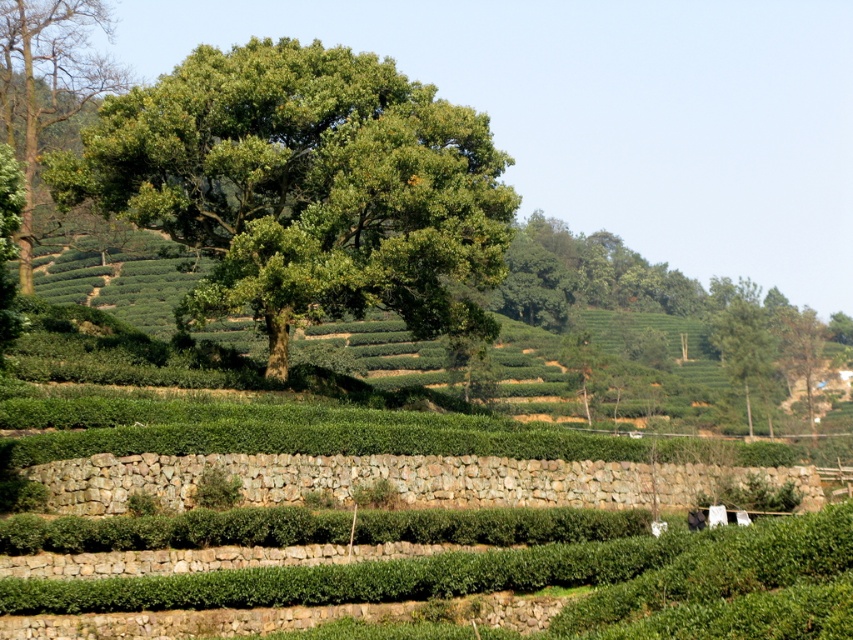
Question: Which object is closer to the camera taking this photo?

Choices:
 (A) green leafy tree at upper right
 (B) green leafy tree at upper left
 (C) green leafy tree at center

Answer: (B)

Question: Which point is farther from the camera taking this photo?

Choices:
 (A) (207, 115)
 (B) (764, 348)

Answer: (B)

Question: Is green leafy tree at upper left further to camera compared to green leafy tree at upper right?

Choices:
 (A) no
 (B) yes

Answer: (A)

Question: Is green leafy tree at center below green leafy tree at upper left?

Choices:
 (A) yes
 (B) no

Answer: (A)

Question: Does green leafy tree at upper left have a smaller size compared to green leafy tree at upper right?

Choices:
 (A) yes
 (B) no

Answer: (B)

Question: Among these points, which one is nearest to the camera?

Choices:
 (A) (218, 202)
 (B) (21, 228)

Answer: (A)